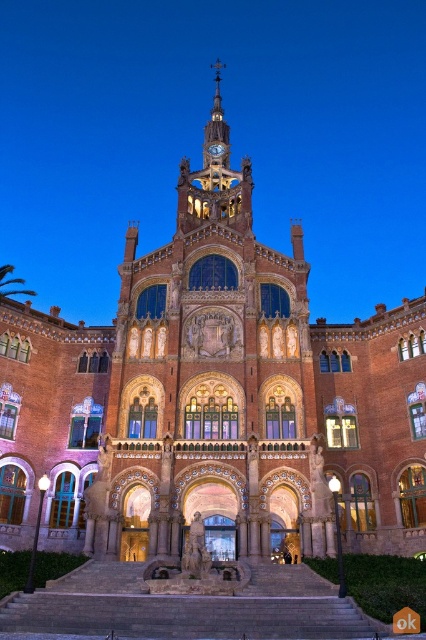
Looking at this image, you are an architect examining the building facade. You notice the golden ornate clock tower at upper center and the gold metallic clock at upper center. Which object occupies a larger horizontal space on the facade?

The golden ornate clock tower at upper center might be wider than gold metallic clock at upper center, so the clock tower likely occupies more horizontal space than the clock.

You are an architect examining the building facade. You notice the golden ornate clock tower at upper center and the gold metallic clock at upper center. Which of these two objects is larger in size?

The golden ornate clock tower at upper center is bigger than the gold metallic clock at upper center.

You are standing in front of the grand building and want to take a photo that includes both the clock tower and the point at coordinates point (x=213, y=140). Given that your camera has a maximum zoom range of 100 meters, will you be able to capture both elements in a single frame without moving closer?

The distance between point (x=213, y=140) and the viewer is 92.42 meters. Since the camera can zoom up to 100 meters, you can capture both the clock tower and the point in a single frame without moving closer.